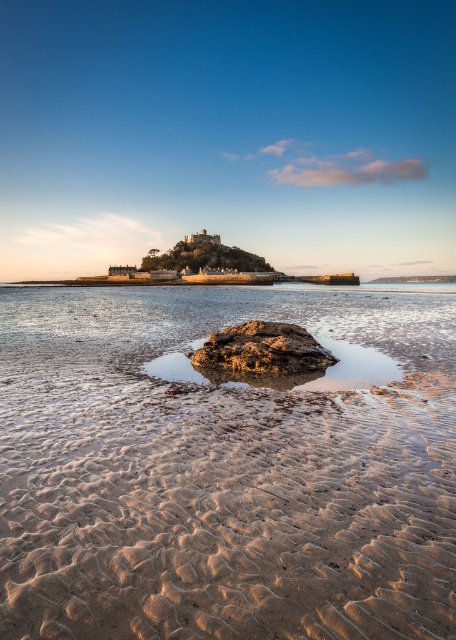
Question: Observing the image, what is the correct spatial positioning of smooth sand at lower center in reference to rusty metallic rock at center?

Choices:
 (A) below
 (B) above

Answer: (A)

Question: From the image, what is the correct spatial relationship of smooth sand at lower center in relation to rusty metallic rock at center?

Choices:
 (A) above
 (B) below

Answer: (B)

Question: Is smooth sand at lower center bigger than rusty metallic rock at center?

Choices:
 (A) yes
 (B) no

Answer: (B)

Question: Which of the following is the farthest from the observer?

Choices:
 (A) smooth sand at lower center
 (B) rusty metallic rock at center

Answer: (B)